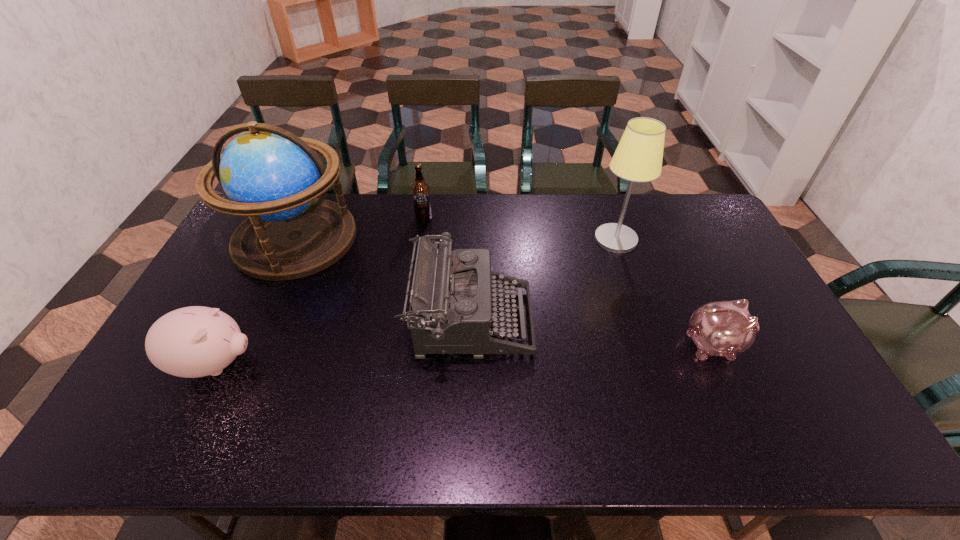
I want to click on globe, so click(x=269, y=174).

At what (x,y) coordinates should I click in order to perform the action: click on table lamp. Please return your answer as a coordinate pair (x, y). The image size is (960, 540). Looking at the image, I should click on (638, 158).

Where is `beer bottle`? This screenshot has width=960, height=540. beer bottle is located at coordinates (420, 190).

The width and height of the screenshot is (960, 540). In order to click on typewriter in this screenshot , I will do `click(450, 312)`.

Where is `the taller piggy bank`? This screenshot has height=540, width=960. the taller piggy bank is located at coordinates (196, 341).

I want to click on the fifth tallest object, so click(x=196, y=341).

Locate an element on the screen. Image resolution: width=960 pixels, height=540 pixels. the shorter piggy bank is located at coordinates (719, 328).

Find the location of a particular element. The image size is (960, 540). the rightmost object is located at coordinates (719, 328).

Locate an element on the screen. The height and width of the screenshot is (540, 960). free space located on the front of the globe is located at coordinates (262, 313).

You are a GUI agent. You are given a task and a screenshot of the screen. Output one action in this format:
    pyautogui.click(x=<x>, y=<y>)
    Task: Click on the free space located on the right of the fifth object from left to right
    Image resolution: width=960 pixels, height=540 pixels.
    Given the screenshot: What is the action you would take?
    pyautogui.click(x=690, y=239)